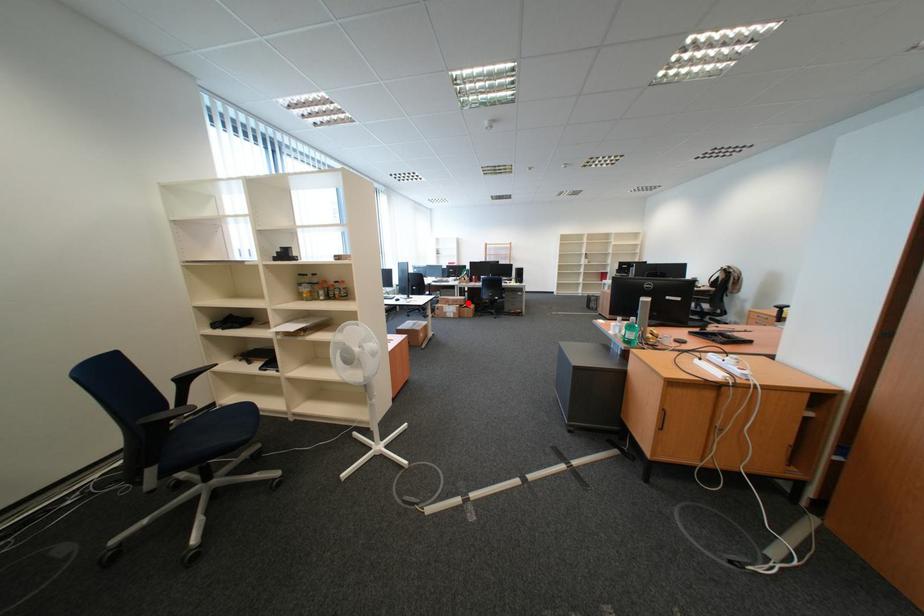
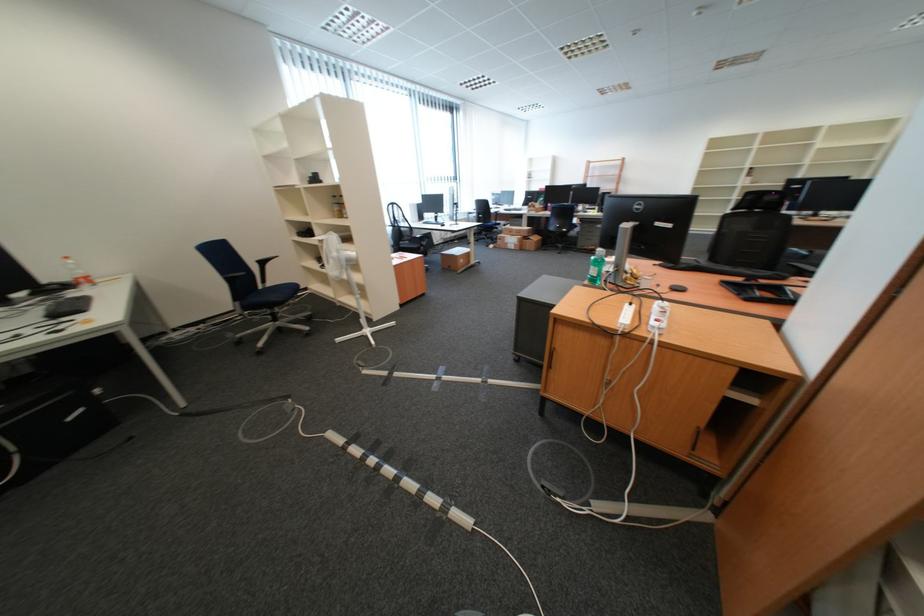
Where in the second image is the point corresponding to the highlighted location from the first image?

(531, 233)